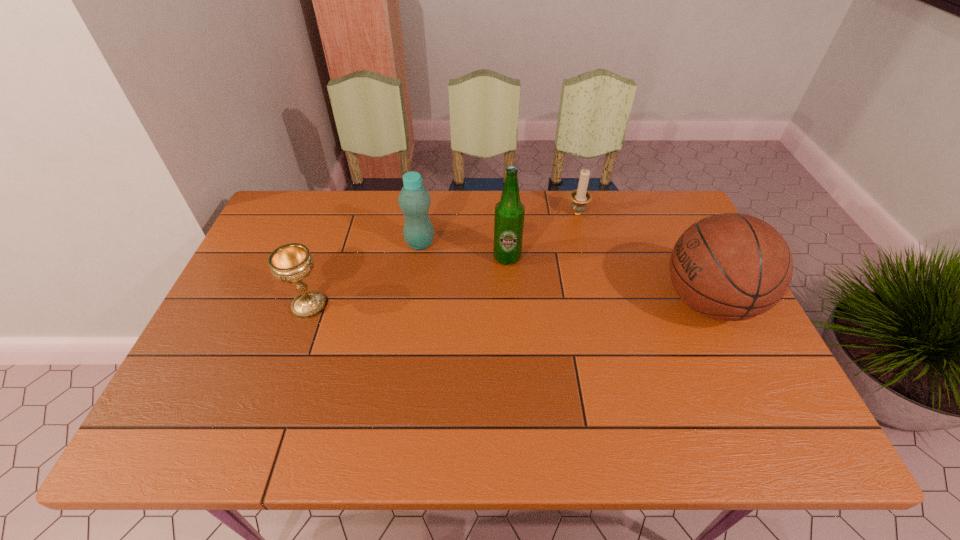
This screenshot has height=540, width=960. I want to click on water bottle that is at the far edge, so (414, 199).

You are a GUI agent. You are given a task and a screenshot of the screen. Output one action in this format:
    pyautogui.click(x=<x>, y=<y>)
    Task: Click on the object present at the right edge
    Image resolution: width=960 pixels, height=540 pixels.
    Given the screenshot: What is the action you would take?
    tap(731, 267)

Identify the location of vacant space at the far edge of the desktop. (431, 210).

This screenshot has width=960, height=540. I want to click on vacant position at the near edge of the desktop, so click(531, 403).

This screenshot has height=540, width=960. What are the coordinates of `vacant region at the left edge of the desktop` in the screenshot? It's located at (276, 279).

The image size is (960, 540). In the image, there is a desktop. In order to click on vacant region at the right edge in this screenshot , I will do `click(657, 252)`.

Find the location of a particular element. This screenshot has height=540, width=960. free space at the far left corner of the desktop is located at coordinates (276, 225).

In the image, there is a desktop. At what (x,y) coordinates should I click in order to perform the action: click on vacant region at the far right corner. Please return your answer as a coordinate pair (x, y). Looking at the image, I should click on (664, 211).

This screenshot has height=540, width=960. I want to click on vacant space that's between the chalice and the candle_holder, so click(444, 260).

Identify the location of empty space between the beer bottle and the water bottle. The width and height of the screenshot is (960, 540). (464, 251).